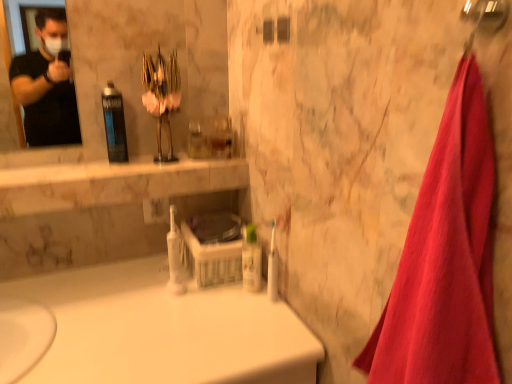
I want to click on free space to the left of white plastic toothbrush at center, so click(x=211, y=316).